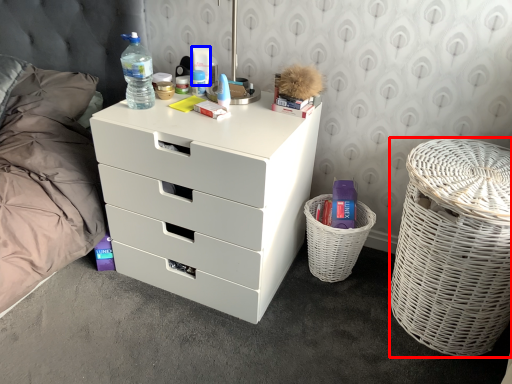
Question: Which object is closer to the camera taking this photo, basket container (highlighted by a red box) or toiletry (highlighted by a blue box)?

Choices:
 (A) basket container
 (B) toiletry

Answer: (A)